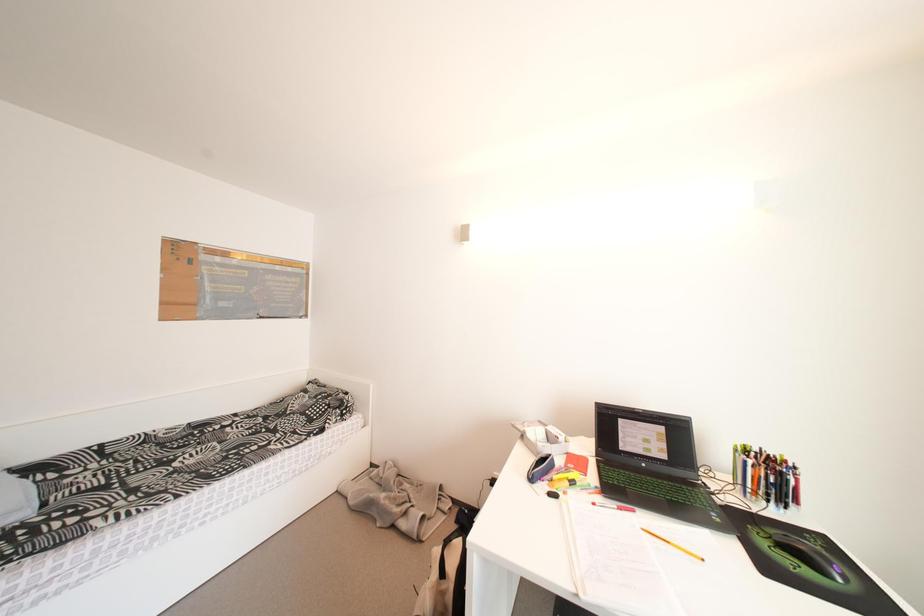
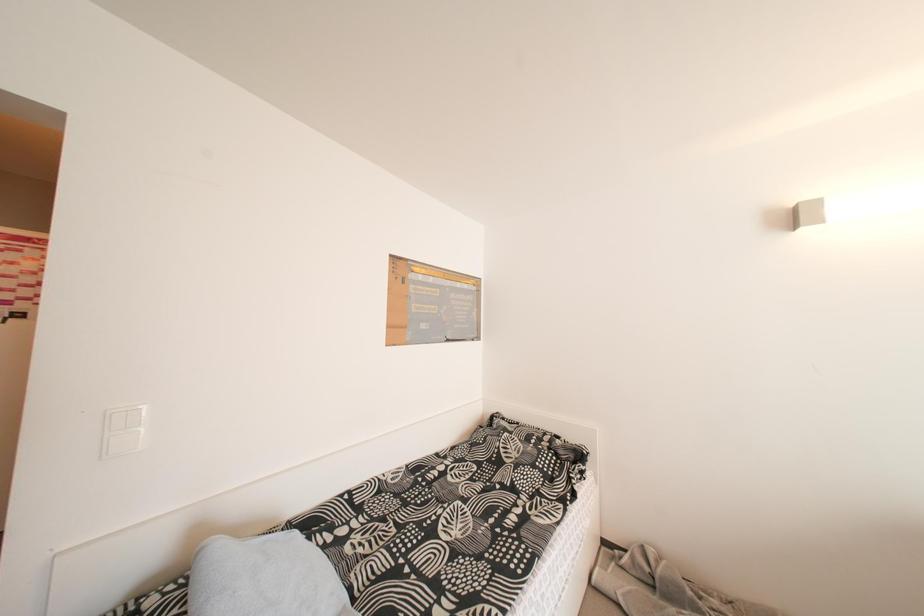
Question: The images are taken continuously from a first-person perspective. In which direction are you moving?

Choices:
 (A) Left
 (B) Right
 (C) Forward
 (D) Backward

Answer: (A)